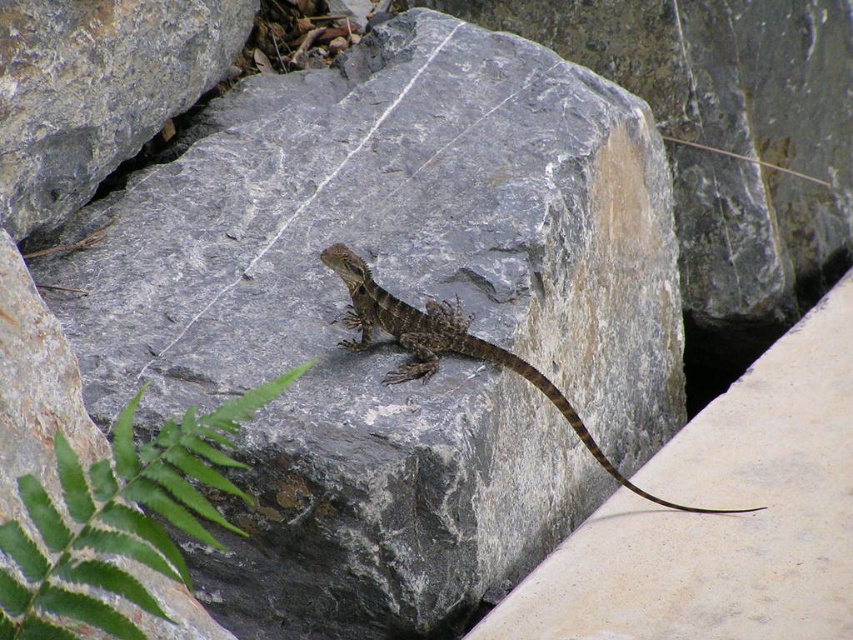
Which of these two, green leafy fern at lower left or brown scaly lizard at center, stands shorter?

Standing shorter between the two is green leafy fern at lower left.

Measure the distance between green leafy fern at lower left and camera.

A distance of 87.82 centimeters exists between green leafy fern at lower left and camera.

Identify the location of green leafy fern at lower left. (119, 518).

From the picture: Is smooth concrete ledge at lower right taller than gray rough rock at center?

Yes.

Based on the photo, which of these two, smooth concrete ledge at lower right or gray rough rock at center, stands taller?

smooth concrete ledge at lower right

Locate an element on the screen. The width and height of the screenshot is (853, 640). smooth concrete ledge at lower right is located at coordinates (721, 515).

Which is below, smooth concrete ledge at lower right or green leafy fern at lower left?

smooth concrete ledge at lower right

The image size is (853, 640). What do you see at coordinates (721, 515) in the screenshot? I see `smooth concrete ledge at lower right` at bounding box center [721, 515].

Where is `smooth concrete ledge at lower right`? The height and width of the screenshot is (640, 853). smooth concrete ledge at lower right is located at coordinates (721, 515).

Locate an element on the screen. The image size is (853, 640). smooth concrete ledge at lower right is located at coordinates (721, 515).